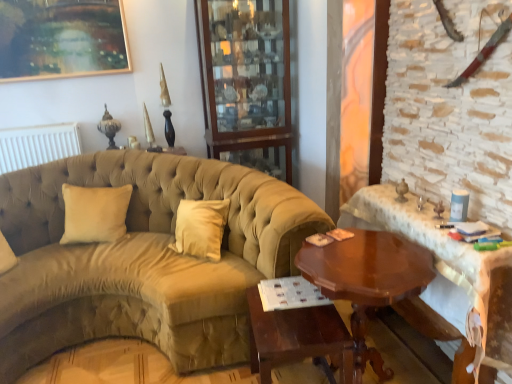
Image resolution: width=512 pixels, height=384 pixels. Identify the location of shiny brown wood table at right, the 2th table in the left-to-right sequence. (367, 281).

Find the location of a particular element. The height and width of the screenshot is (384, 512). mahogany wood table at center, which is the 1th table from left to right is located at coordinates (297, 338).

What do you see at coordinates (95, 213) in the screenshot? This screenshot has width=512, height=384. I see `beige velvet pillow at left` at bounding box center [95, 213].

Locate an element on the screen. This screenshot has height=384, width=512. beige velvet pillow at left is located at coordinates (95, 213).

The width and height of the screenshot is (512, 384). What are the coordinates of `suede-like beige couch at center` in the screenshot? It's located at (143, 259).

In order to face wooden glass cabinet at upper center, should I rotate leftwards or rightwards?

Turn left approximately 1.593 degrees to face it.

Describe the element at coordinates (247, 82) in the screenshot. I see `wooden glass cabinet at upper center` at that location.

Image resolution: width=512 pixels, height=384 pixels. Find the location of `shiny brown wood table at right, which ranks as the third table in left-to-right order`. shiny brown wood table at right, which ranks as the third table in left-to-right order is located at coordinates (443, 262).

Identify the location of gold-framed painting at upper left. This screenshot has height=384, width=512. point(61,39).

Looking at their sizes, would you say suede-like beige couch at center is wider or thinner than wooden glass cabinet at upper center?

Clearly, suede-like beige couch at center has more width compared to wooden glass cabinet at upper center.

Based on the photo, is suede-like beige couch at center positioned with its back to wooden glass cabinet at upper center?

No, wooden glass cabinet at upper center is not at the back of suede-like beige couch at center.

Looking at this image, is suede-like beige couch at center directly adjacent to wooden glass cabinet at upper center?

suede-like beige couch at center and wooden glass cabinet at upper center are not in contact.

What's the angular difference between suede-like beige couch at center and wooden glass cabinet at upper center's facing directions?

They differ by 4.62 degrees in their facing directions.

Does mahogany wood table at center, which is the 1th table from left to right, have a greater height compared to suede-like beige couch at center?

No.

From a real-world perspective, between mahogany wood table at center, acting as the third table starting from the right, and suede-like beige couch at center, who is vertically higher?

suede-like beige couch at center, from a real-world perspective.

Considering the positions of point (284, 350) and point (274, 238), is point (284, 350) closer or farther from the camera than point (274, 238)?

Point (284, 350) is closer to the camera than point (274, 238).

Between mahogany wood table at center, which is the 1th table from left to right, and suede-like beige couch at center, which one has smaller width?

Thinner between the two is mahogany wood table at center, which is the 1th table from left to right.

Would you say shiny brown wood table at right, which is counted as the 2th table, starting from the right, is part of gold-framed painting at upper left's contents?

No, shiny brown wood table at right, which is counted as the 2th table, starting from the right, is located outside of gold-framed painting at upper left.

Does point (60, 68) lie in front of point (365, 244)?

No.

From a real-world perspective, count 2nd tables downward from the gold-framed painting at upper left and point to it. Please provide its 2D coordinates.

[(367, 281)]

Who is smaller, gold-framed painting at upper left or shiny brown wood table at right, which is counted as the 2th table, starting from the right?

gold-framed painting at upper left.

Could you measure the distance between gold-framed painting at upper left and mahogany wood table at center, acting as the third table starting from the right?

gold-framed painting at upper left is 2.19 meters from mahogany wood table at center, acting as the third table starting from the right.

From the image's perspective, is gold-framed painting at upper left positioned above or below mahogany wood table at center, which is the 1th table from left to right?

gold-framed painting at upper left is above mahogany wood table at center, which is the 1th table from left to right.

This screenshot has height=384, width=512. In order to click on picture frame lying on the left of mahogany wood table at center, acting as the third table starting from the right in this screenshot , I will do `click(61, 39)`.

Does gold-framed painting at upper left turn towards mahogany wood table at center, acting as the third table starting from the right?

No, gold-framed painting at upper left is not oriented towards mahogany wood table at center, acting as the third table starting from the right.

Is suede-like beige couch at center positioned far away from beige velvet pillow at left?

No, suede-like beige couch at center is in close proximity to beige velvet pillow at left.

Is suede-like beige couch at center positioned with its back to beige velvet pillow at left?

Yes, suede-like beige couch at center is positioned with its back facing beige velvet pillow at left.

Where is `pillow behind the suede-like beige couch at center`? Image resolution: width=512 pixels, height=384 pixels. pillow behind the suede-like beige couch at center is located at coordinates (95, 213).

From the image's perspective, is suede-like beige couch at center above beige velvet pillow at left?

No.

Is shiny brown wood table at right, which is counted as the 2th table, starting from the right, closer to the viewer compared to beige velvet pillow at left?

Yes, shiny brown wood table at right, which is counted as the 2th table, starting from the right, is in front of beige velvet pillow at left.

Consider the image. Is shiny brown wood table at right, which is counted as the 2th table, starting from the right, spatially inside beige velvet pillow at left, or outside of it?

shiny brown wood table at right, which is counted as the 2th table, starting from the right, is not enclosed by beige velvet pillow at left.

Considering the relative sizes of shiny brown wood table at right, which is counted as the 2th table, starting from the right, and beige velvet pillow at left in the image provided, is shiny brown wood table at right, which is counted as the 2th table, starting from the right, taller than beige velvet pillow at left?

Indeed, shiny brown wood table at right, which is counted as the 2th table, starting from the right, has a greater height compared to beige velvet pillow at left.

Is point (354, 317) positioned after point (76, 230)?

No, (354, 317) is in front of (76, 230).

Is gold-framed painting at upper left looking in the opposite direction of shiny brown wood table at right, which ranks as the third table in left-to-right order?

No, gold-framed painting at upper left's orientation is not away from shiny brown wood table at right, which ranks as the third table in left-to-right order.

From a real-world perspective, is gold-framed painting at upper left positioned under shiny brown wood table at right, which ranks as the third table in left-to-right order, based on gravity?

Actually, gold-framed painting at upper left is physically above shiny brown wood table at right, which ranks as the third table in left-to-right order, in the real world.

Visually, is gold-framed painting at upper left positioned to the left or to the right of shiny brown wood table at right, which is the first table in right-to-left order?

Clearly, gold-framed painting at upper left is on the left of shiny brown wood table at right, which is the first table in right-to-left order, in the image.

Does gold-framed painting at upper left touch shiny brown wood table at right, which is the first table in right-to-left order?

No.

Image resolution: width=512 pixels, height=384 pixels. I want to click on bookshelf that is behind the suede-like beige couch at center, so click(x=247, y=82).

Find the location of `the 1st table in front of the suede-like beige couch at center`. the 1st table in front of the suede-like beige couch at center is located at coordinates (297, 338).

Based on their spatial positions, is suede-like beige couch at center or gold-framed painting at upper left closer to mahogany wood table at center, which is the 1th table from left to right?

suede-like beige couch at center.

Based on the photo, considering their positions, is shiny brown wood table at right, which ranks as the third table in left-to-right order, positioned further to wooden glass cabinet at upper center than suede-like beige couch at center?

The object further to wooden glass cabinet at upper center is shiny brown wood table at right, which ranks as the third table in left-to-right order.

Considering their positions, is wooden glass cabinet at upper center positioned closer to beige velvet pillow at left than mahogany wood table at center, acting as the third table starting from the right?

wooden glass cabinet at upper center lies closer to beige velvet pillow at left than the other object.

Estimate the real-world distances between objects in this image. Which object is further from beige velvet pillow at left, shiny brown wood table at right, which is counted as the 2th table, starting from the right, or suede-like beige couch at center?

The object further to beige velvet pillow at left is shiny brown wood table at right, which is counted as the 2th table, starting from the right.

When comparing their distances from suede-like beige couch at center, does gold-framed painting at upper left or beige velvet pillow at left seem closer?

beige velvet pillow at left lies closer to suede-like beige couch at center than the other object.

From the image, which object appears to be nearer to shiny brown wood table at right, the 2th table in the left-to-right sequence, wooden glass cabinet at upper center or mahogany wood table at center, which is the 1th table from left to right?

Based on the image, mahogany wood table at center, which is the 1th table from left to right, appears to be nearer to shiny brown wood table at right, the 2th table in the left-to-right sequence.

Estimate the real-world distances between objects in this image. Which object is closer to wooden glass cabinet at upper center, shiny brown wood table at right, the 2th table in the left-to-right sequence, or gold-framed painting at upper left?

Among the two, gold-framed painting at upper left is located nearer to wooden glass cabinet at upper center.

From the image, which object appears to be nearer to suede-like beige couch at center, shiny brown wood table at right, the 2th table in the left-to-right sequence, or mahogany wood table at center, acting as the third table starting from the right?

Result: Among the two, mahogany wood table at center, acting as the third table starting from the right, is located nearer to suede-like beige couch at center.

The height and width of the screenshot is (384, 512). What are the coordinates of `bookshelf situated between gold-framed painting at upper left and shiny brown wood table at right, which is the first table in right-to-left order, from left to right` in the screenshot? It's located at (247, 82).

Identify the location of bookshelf located between beige velvet pillow at left and shiny brown wood table at right, the 2th table in the left-to-right sequence, in the left-right direction. (247, 82).

Where is `pillow between wooden glass cabinet at upper center and mahogany wood table at center, which is the 1th table from left to right, in the vertical direction`? The image size is (512, 384). pillow between wooden glass cabinet at upper center and mahogany wood table at center, which is the 1th table from left to right, in the vertical direction is located at coordinates (95, 213).

You are a GUI agent. You are given a task and a screenshot of the screen. Output one action in this format:
    pyautogui.click(x=<x>, y=<y>)
    Task: Click on the pillow between gold-framed painting at upper left and mahogany wood table at center, which is the 1th table from left to right, in the up-down direction
    The image size is (512, 384).
    Given the screenshot: What is the action you would take?
    pyautogui.click(x=95, y=213)